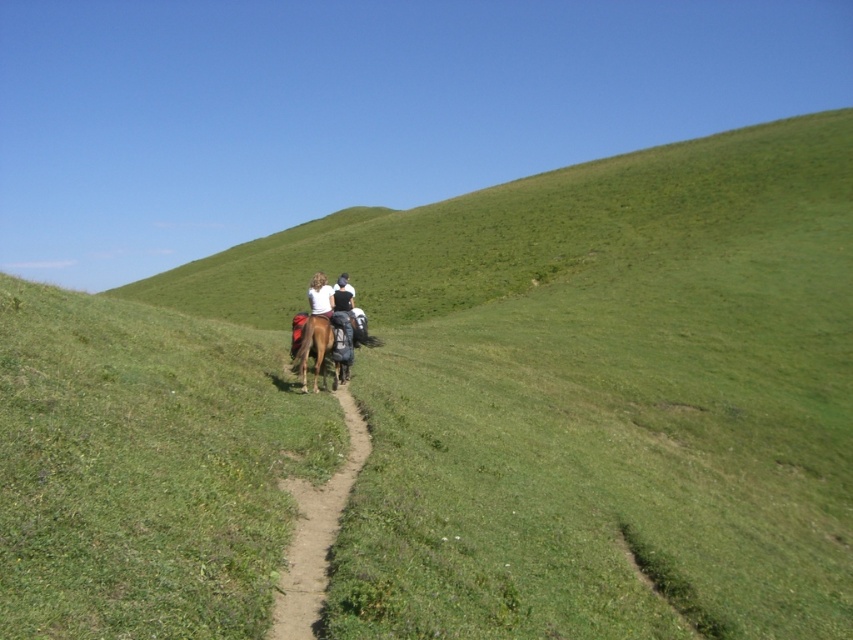
Does brown dirt path at center have a greater height compared to brown glossy horse at center?

Incorrect, brown dirt path at center's height is not larger of brown glossy horse at center's.

Can you confirm if brown dirt path at center is smaller than brown glossy horse at center?

Indeed, brown dirt path at center has a smaller size compared to brown glossy horse at center.

The width and height of the screenshot is (853, 640). I want to click on brown dirt path at center, so click(x=315, y=532).